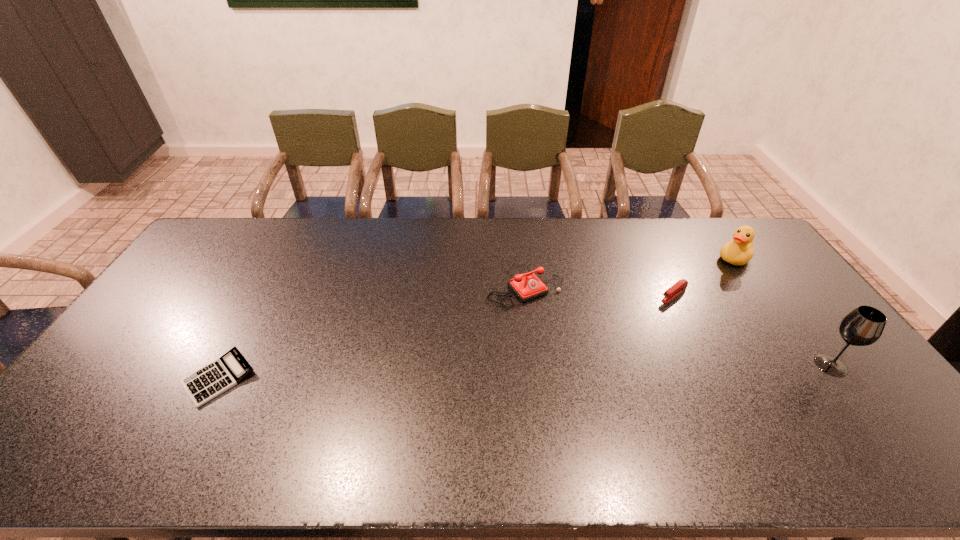
Locate an element on the screen. This screenshot has width=960, height=540. object that is the second nearest to the wineglass is located at coordinates coord(739,251).

Locate an element on the screen. This screenshot has width=960, height=540. the fourth closest object to the third tallest object is located at coordinates (863, 326).

Locate an element on the screen. The image size is (960, 540). free spot that satisfies the following two spatial constraints: 1. on the back side of the leftmost object; 2. on the right side of the duck is located at coordinates (282, 259).